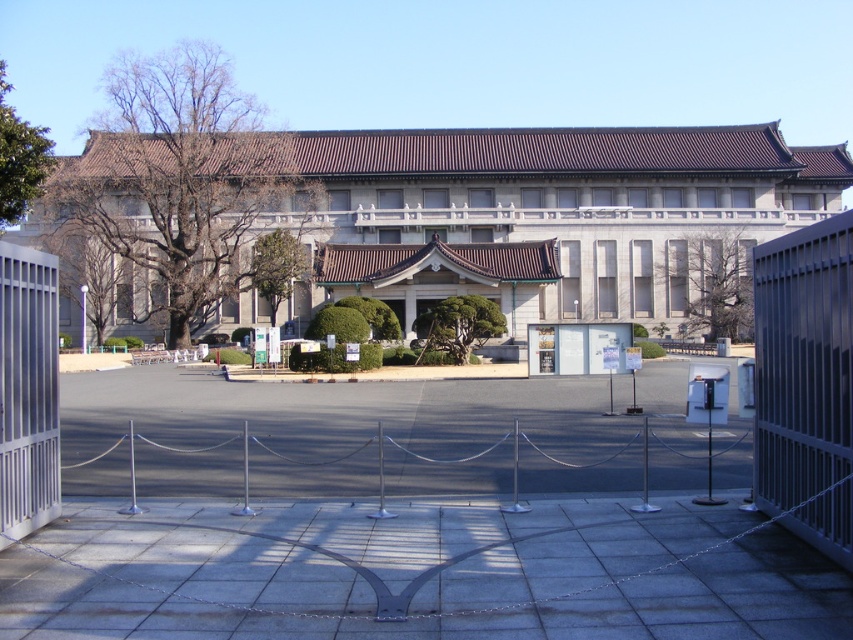
You are standing at the entrance of the stone gray building at center. You want to walk straight ahead towards the paved area in front of the building. Which direction should you face to walk directly away from the building?

Since the stone gray building at center is positioned at point (450, 220), walking straight ahead from the entrance would mean facing away from the building towards the paved area in front of it. Therefore, you should face forward, away from the building, to walk directly away from it.

You are standing in front of the building and want to take a photo that includes both the point at coordinates point (822, 460) and point (6, 323). Which point should you focus on to ensure both are in sharp focus?

You should focus on point (6, 323) because it is farther from the camera than point (822, 460). By focusing on the farther point, the closer point will also be within the depth of field, ensuring both are in focus.

You are a visitor approaching the stone gray building at center. There is a silver metallic fence at center in your path. Can you walk directly to the building without going around the fence?

The silver metallic fence at center is behind stone gray building at center, so you can walk directly to the stone gray building at center without needing to go around the fence since the fence is located behind the building.